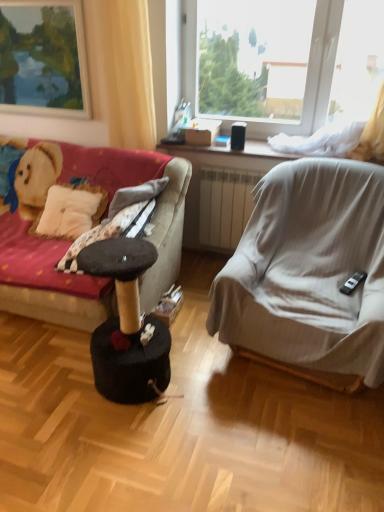
Question: From the image's perspective, is matte wooden picture frame at upper left beneath black felt cat tree at center?

Choices:
 (A) no
 (B) yes

Answer: (A)

Question: Considering the relative sizes of matte wooden picture frame at upper left and black felt cat tree at center in the image provided, is matte wooden picture frame at upper left bigger than black felt cat tree at center?

Choices:
 (A) no
 (B) yes

Answer: (A)

Question: Is black felt cat tree at center completely or partially inside matte wooden picture frame at upper left?

Choices:
 (A) no
 (B) yes

Answer: (A)

Question: Is matte wooden picture frame at upper left further to the viewer compared to black felt cat tree at center?

Choices:
 (A) no
 (B) yes

Answer: (B)

Question: From the image's perspective, does matte wooden picture frame at upper left appear higher than black felt cat tree at center?

Choices:
 (A) no
 (B) yes

Answer: (B)

Question: From a real-world perspective, is matte wooden picture frame at upper left below black felt cat tree at center?

Choices:
 (A) no
 (B) yes

Answer: (A)

Question: Does black felt cat tree at center touch light gray fabric chair at right?

Choices:
 (A) yes
 (B) no

Answer: (B)

Question: From a real-world perspective, is black felt cat tree at center physically below light gray fabric chair at right?

Choices:
 (A) no
 (B) yes

Answer: (B)

Question: Is black felt cat tree at center at the right side of light gray fabric chair at right?

Choices:
 (A) yes
 (B) no

Answer: (B)

Question: From the image's perspective, is black felt cat tree at center on light gray fabric chair at right?

Choices:
 (A) no
 (B) yes

Answer: (A)

Question: Is black felt cat tree at center at the left side of light gray fabric chair at right?

Choices:
 (A) yes
 (B) no

Answer: (A)

Question: Are black felt cat tree at center and light gray fabric chair at right far apart?

Choices:
 (A) no
 (B) yes

Answer: (A)

Question: From a real-world perspective, is black felt cat tree at center under yellow fabric curtain at upper left?

Choices:
 (A) yes
 (B) no

Answer: (A)